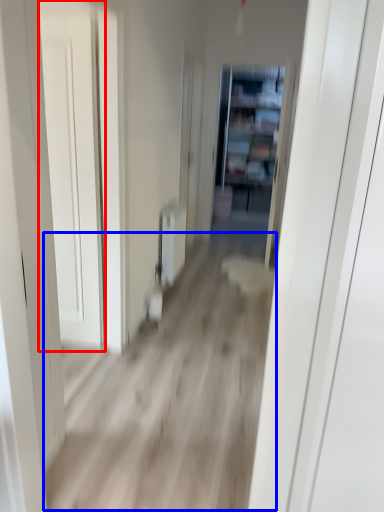
Question: Which point is closer to the camera, door (highlighted by a red box) or corridor (highlighted by a blue box)?

Choices:
 (A) door
 (B) corridor

Answer: (B)